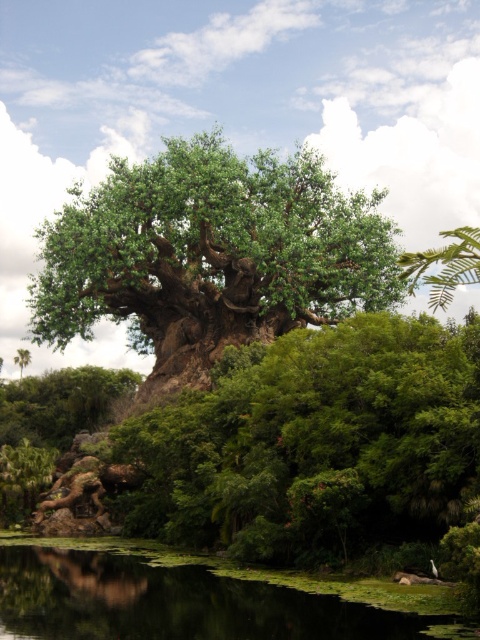
Identify the location of green rough bark tree at center. (211, 256).

Describe the element at coordinates (211, 256) in the screenshot. I see `green rough bark tree at center` at that location.

Is point (85, 323) closer to camera compared to point (191, 595)?

No.

Locate an element on the screen. The width and height of the screenshot is (480, 640). green rough bark tree at center is located at coordinates (211, 256).

Consider the image. Which is more to the right, green algae water at lower center or green leafy tree at upper right?

Positioned to the right is green leafy tree at upper right.

In the scene shown: Is green algae water at lower center to the right of green leafy tree at upper right from the viewer's perspective?

No, green algae water at lower center is not to the right of green leafy tree at upper right.

Which is in front, point (190, 605) or point (450, 253)?

Point (450, 253) is in front.

Find the location of a particular element. This screenshot has height=640, width=480. green algae water at lower center is located at coordinates (188, 600).

Between green algae water at lower center and green leafy tree at center, which one has more height?

green algae water at lower center

Which is below, green algae water at lower center or green leafy tree at center?

green algae water at lower center is below.

Find the location of a particular element. The width and height of the screenshot is (480, 640). green algae water at lower center is located at coordinates (188, 600).

Image resolution: width=480 pixels, height=640 pixels. Find the location of `green algae water at lower center`. green algae water at lower center is located at coordinates [188, 600].